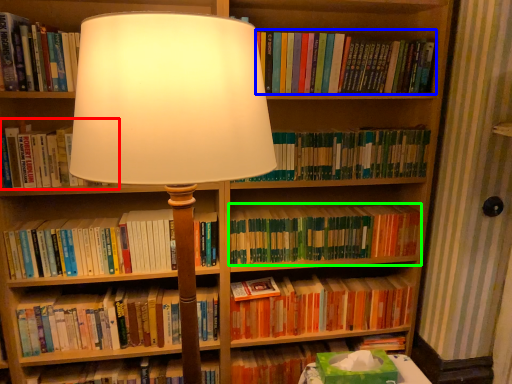
Question: Which object is the farthest from book (highlighted by a red box)? Choose among these: book (highlighted by a blue box) or book (highlighted by a green box).

Choices:
 (A) book
 (B) book

Answer: (A)